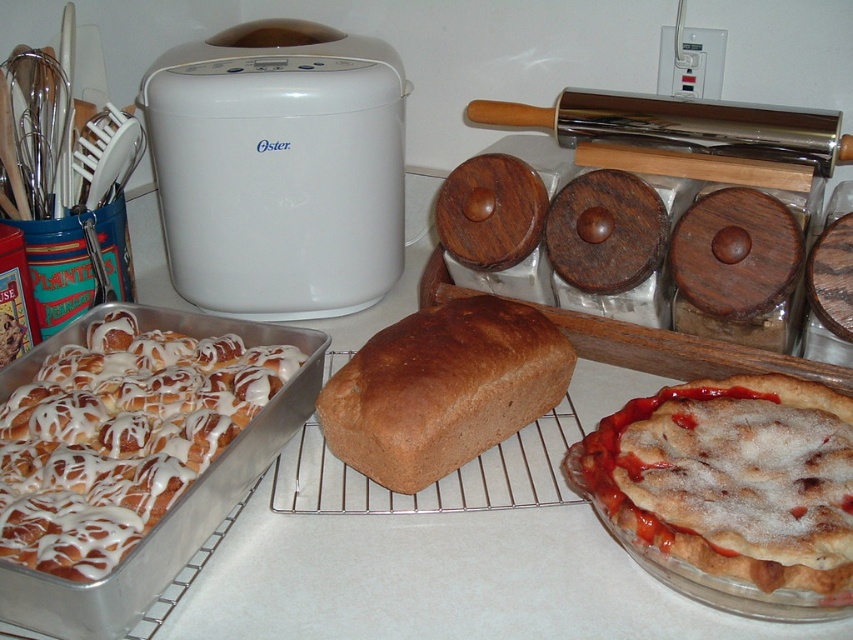
Question: Can you confirm if white glazed pastry at left is thinner than glazed pastry at center?

Choices:
 (A) yes
 (B) no

Answer: (B)

Question: Is the position of white glazed pastry at left less distant than that of glazed pastry at center?

Choices:
 (A) yes
 (B) no

Answer: (A)

Question: Which is farther from the white plastic bread maker at upper left?

Choices:
 (A) brown matte loaf of bread at center
 (B) white glazed pastry at left

Answer: (A)

Question: Which point is closer to the camera taking this photo?

Choices:
 (A) (497, 298)
 (B) (234, 404)

Answer: (B)

Question: Is white glazed pastry at left in front of glazed pastry at center?

Choices:
 (A) yes
 (B) no

Answer: (A)

Question: Which point is farther to the camera?

Choices:
 (A) white plastic bread maker at upper left
 (B) brown matte loaf of bread at center
 (C) white glazed pastry at left

Answer: (A)